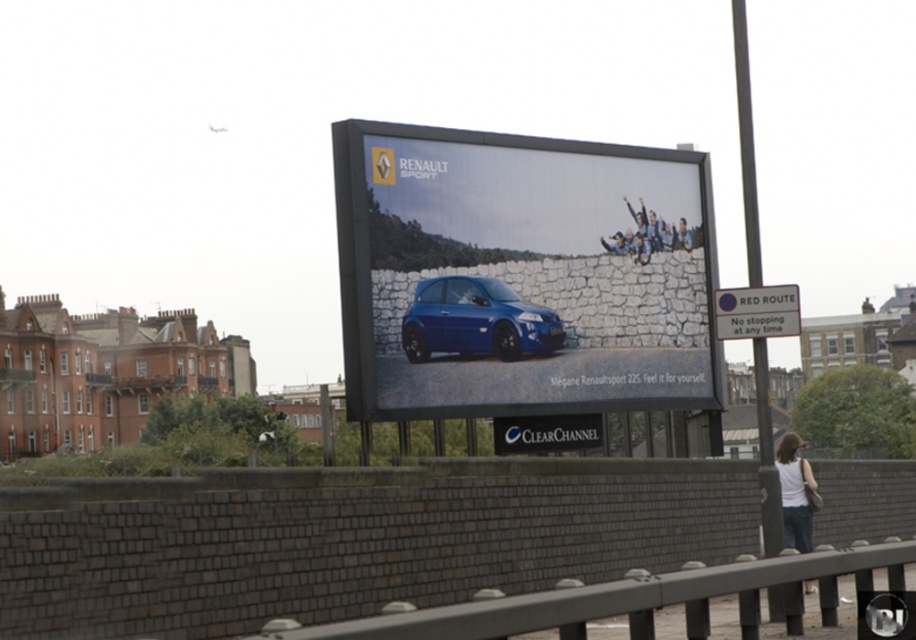
Question: Is matte blue hatchback at center in front of white fabric shirt at lower right?

Choices:
 (A) no
 (B) yes

Answer: (A)

Question: Is matte blue hatchback at center thinner than white fabric shirt at lower right?

Choices:
 (A) no
 (B) yes

Answer: (B)

Question: Based on their relative distances, which object is nearer to the matte black sign at center?

Choices:
 (A) matte blue hatchback at center
 (B) blue fabric people at center

Answer: (A)

Question: Among these points, which one is farthest from the camera?

Choices:
 (A) (795, 525)
 (B) (488, 278)
 (C) (601, 435)

Answer: (C)

Question: Can you confirm if white fabric shirt at lower right is bigger than blue fabric people at center?

Choices:
 (A) no
 (B) yes

Answer: (B)

Question: Estimate the real-world distances between objects in this image. Which object is closer to the matte black sign at center?

Choices:
 (A) shiny blue car at center
 (B) blue fabric people at center
 (C) matte blue hatchback at center
 (D) white fabric shirt at lower right

Answer: (C)